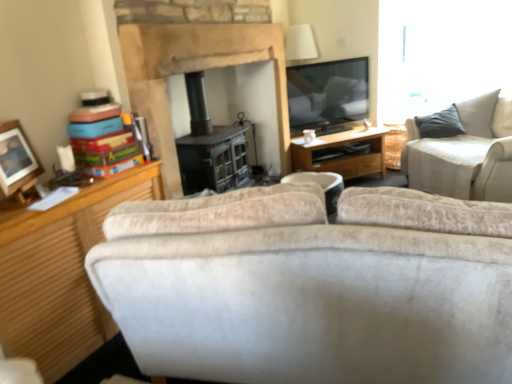
Question: Is wooden desk at center turned away from white ceramic coffee cup at center?

Choices:
 (A) no
 (B) yes

Answer: (A)

Question: From the image's perspective, is wooden desk at center on white ceramic coffee cup at center?

Choices:
 (A) no
 (B) yes

Answer: (A)

Question: Can you confirm if wooden desk at center is shorter than white ceramic coffee cup at center?

Choices:
 (A) yes
 (B) no

Answer: (B)

Question: Considering the relative positions of wooden desk at center and white ceramic coffee cup at center in the image provided, is wooden desk at center to the right of white ceramic coffee cup at center from the viewer's perspective?

Choices:
 (A) yes
 (B) no

Answer: (A)

Question: Considering the relative positions of wooden desk at center and white ceramic coffee cup at center in the image provided, is wooden desk at center behind white ceramic coffee cup at center?

Choices:
 (A) no
 (B) yes

Answer: (A)

Question: In terms of height, does white ceramic coffee cup at center look taller or shorter compared to wooden photo frame at left?

Choices:
 (A) tall
 (B) short

Answer: (B)

Question: Based on their positions, is white ceramic coffee cup at center located to the left or right of wooden photo frame at left?

Choices:
 (A) left
 (B) right

Answer: (B)

Question: In terms of size, does white ceramic coffee cup at center appear bigger or smaller than wooden photo frame at left?

Choices:
 (A) small
 (B) big

Answer: (A)

Question: Does point (309, 134) appear closer or farther from the camera than point (25, 162)?

Choices:
 (A) closer
 (B) farther

Answer: (B)

Question: In the image, is wooden desk at center positioned in front of or behind stone fireplace at center?

Choices:
 (A) front
 (B) behind

Answer: (B)

Question: Is point (375, 144) closer or farther from the camera than point (234, 46)?

Choices:
 (A) closer
 (B) farther

Answer: (B)

Question: Looking at their shapes, would you say wooden desk at center is wider or thinner than stone fireplace at center?

Choices:
 (A) thin
 (B) wide

Answer: (B)

Question: From the image's perspective, is wooden desk at center located above or below stone fireplace at center?

Choices:
 (A) above
 (B) below

Answer: (B)

Question: Looking at the image, does wooden photo frame at left seem bigger or smaller compared to beige fabric couch at upper right?

Choices:
 (A) big
 (B) small

Answer: (B)

Question: From a real-world perspective, is wooden photo frame at left physically located above or below beige fabric couch at upper right?

Choices:
 (A) below
 (B) above

Answer: (B)